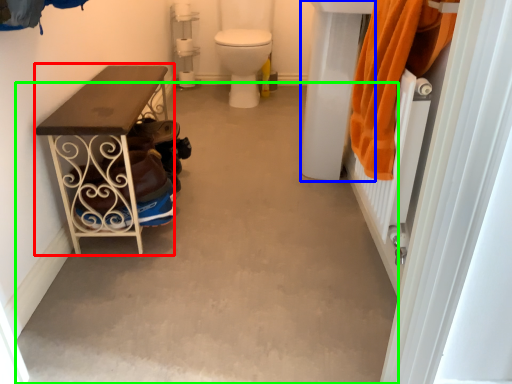
Question: Which object is the closest to the furniture (highlighted by a red box)? Choose among these: sink (highlighted by a blue box) or concrete (highlighted by a green box).

Choices:
 (A) sink
 (B) concrete

Answer: (B)